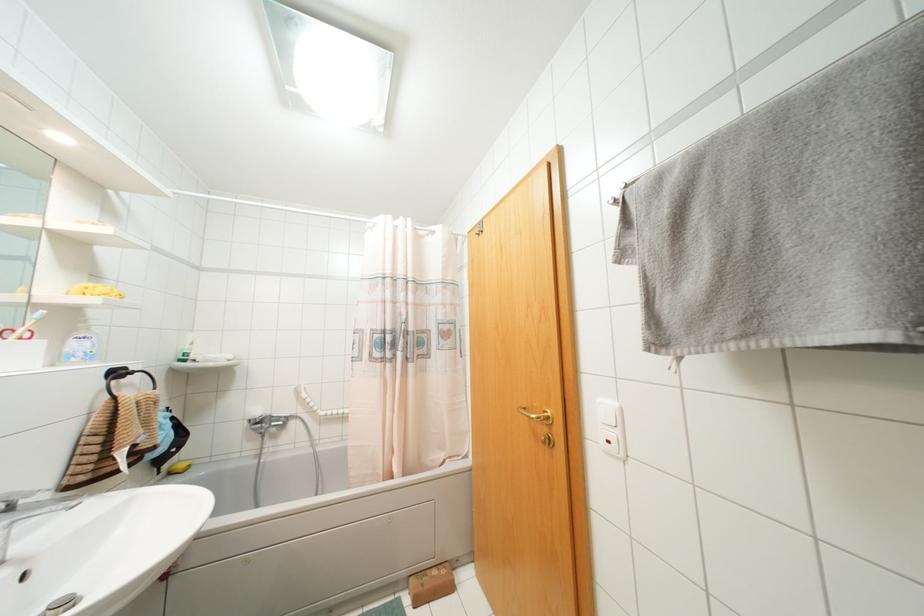
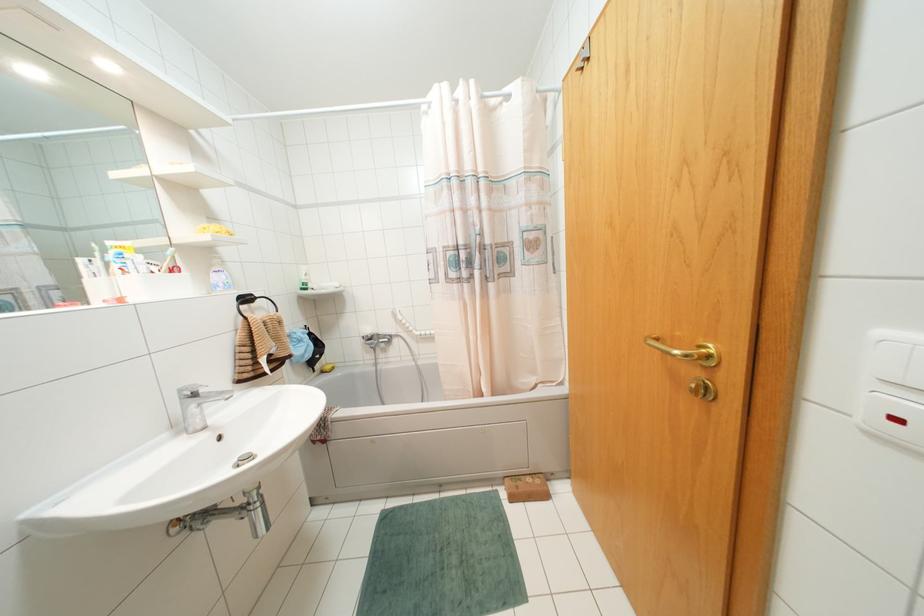
Question: In a continuous first-person perspective shot, in which direction is the camera moving?

Choices:
 (A) Left
 (B) Right
 (C) Forward
 (D) Backward

Answer: (C)